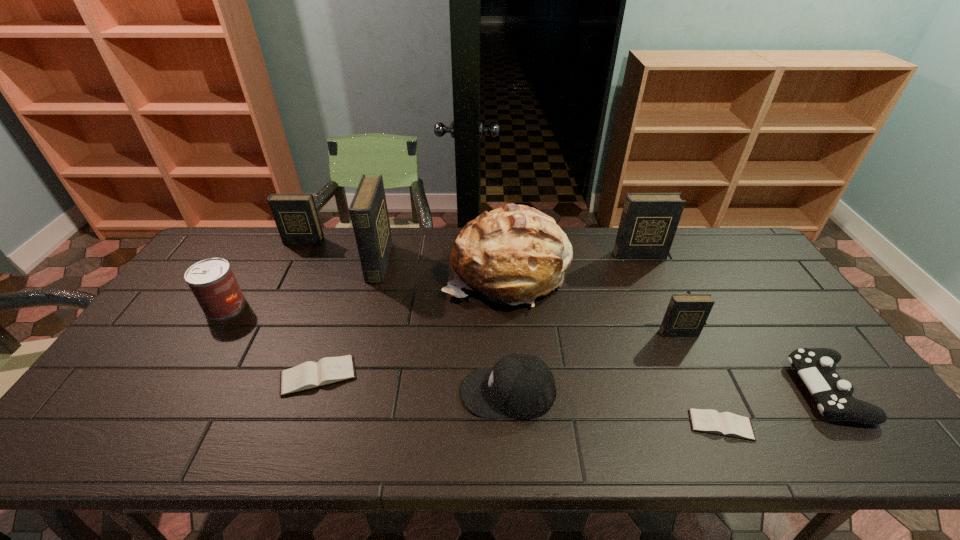
Identify the location of free space located 0.100m on the right of the can. This screenshot has height=540, width=960. (278, 306).

I want to click on blank space located on the front cover of the nearest dark diary, so click(718, 423).

Locate an element on the screen. The height and width of the screenshot is (540, 960). vacant space situated 0.260m on the front-facing side of the cap is located at coordinates (355, 392).

Locate an element on the screen. Image resolution: width=960 pixels, height=540 pixels. free space located on the front-facing side of the cap is located at coordinates (396, 392).

Find the location of `free space located 0.370m on the front-facing side of the cap`. free space located 0.370m on the front-facing side of the cap is located at coordinates (310, 392).

Identify the location of vacant space located 0.330m on the surface of the control. This screenshot has height=540, width=960. (663, 390).

Where is `vacant space located on the surface of the control`? The height and width of the screenshot is (540, 960). vacant space located on the surface of the control is located at coordinates (696, 390).

At what (x,y) coordinates should I click in order to perform the action: click on blank space located 0.330m on the surface of the control. Please return your answer as a coordinate pair (x, y). The image size is (960, 540). Looking at the image, I should click on (663, 390).

Where is `free space located on the left of the fifth farthest diary`? The image size is (960, 540). free space located on the left of the fifth farthest diary is located at coordinates (145, 376).

Locate an element on the screen. Image resolution: width=960 pixels, height=540 pixels. vacant area located on the left of the smaller brown diary is located at coordinates (576, 425).